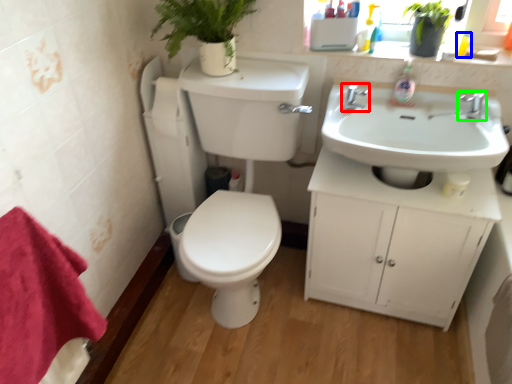
Question: Considering the real-world distances, which object is farthest from tap (highlighted by a red box)? toiletry (highlighted by a blue box) or tap (highlighted by a green box)?

Choices:
 (A) toiletry
 (B) tap

Answer: (A)